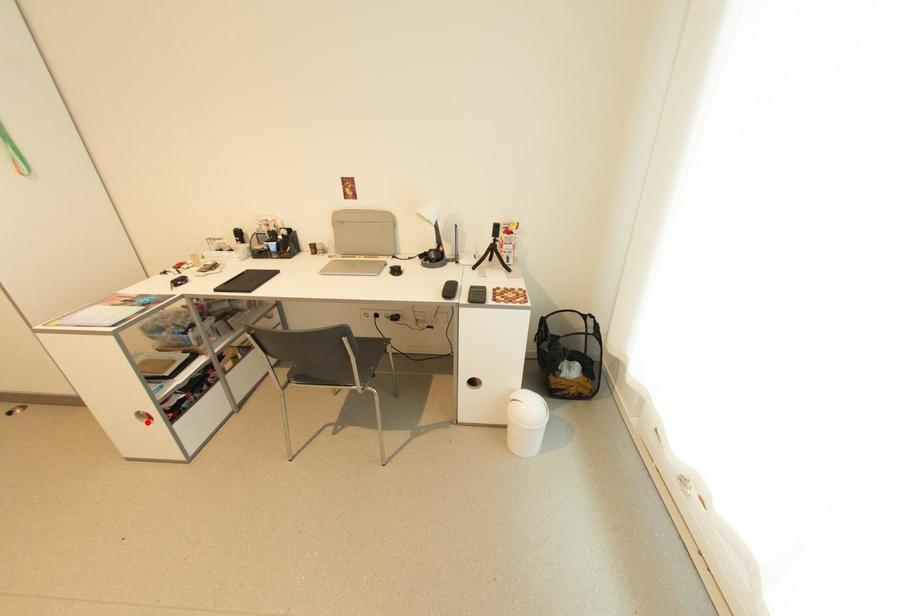
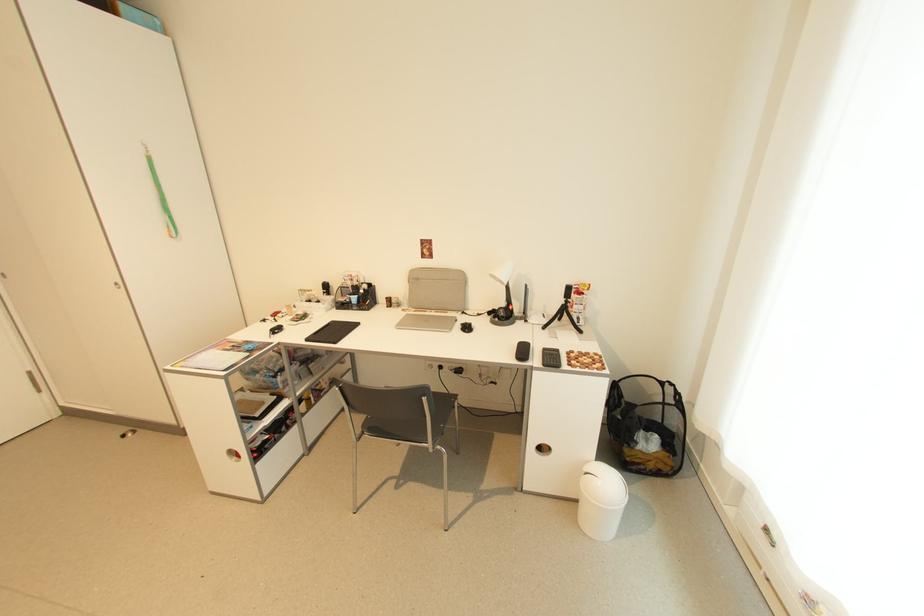
Question: I am providing you with two images of the same scene from different viewpoints. Given a red point in image1, look at the same physical point in image2. Is it:

Choices:
 (A) Closer to the viewpoint
 (B) Farther from the viewpoint

Answer: (B)